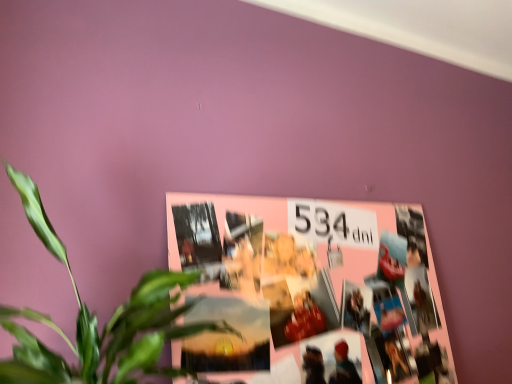
In order to face green leafy plant at center, should I rotate leftwards or rightwards?

You should rotate left by 16.769 degrees.

Identify the location of green leafy plant at center. The image size is (512, 384). (96, 321).

What do you see at coordinates (96, 321) in the screenshot? This screenshot has height=384, width=512. I see `green leafy plant at center` at bounding box center [96, 321].

Locate an element on the screen. pink paper collage at upper center is located at coordinates (308, 288).

What do you see at coordinates (308, 288) in the screenshot?
I see `pink paper collage at upper center` at bounding box center [308, 288].

This screenshot has height=384, width=512. In order to click on green leafy plant at center in this screenshot , I will do `click(96, 321)`.

Visually, is green leafy plant at center positioned to the left or to the right of pink paper collage at upper center?

Clearly, green leafy plant at center is on the left of pink paper collage at upper center in the image.

Is green leafy plant at center positioned behind pink paper collage at upper center?

No, it is in front of pink paper collage at upper center.

Which is behind, point (127, 316) or point (210, 315)?

The point (210, 315) is farther from the camera.

From the image's perspective, which is below, green leafy plant at center or pink paper collage at upper center?

pink paper collage at upper center.

From a real-world perspective, does green leafy plant at center stand above pink paper collage at upper center?

Correct, in the physical world, green leafy plant at center is higher than pink paper collage at upper center.

Which object is wider, green leafy plant at center or pink paper collage at upper center?

green leafy plant at center is wider.

Considering the sizes of green leafy plant at center and pink paper collage at upper center in the image, is green leafy plant at center taller or shorter than pink paper collage at upper center?

green leafy plant at center is shorter than pink paper collage at upper center.

Based on the photo, in terms of size, does green leafy plant at center appear bigger or smaller than pink paper collage at upper center?

Clearly, green leafy plant at center is larger in size than pink paper collage at upper center.

Choose the correct answer: Is green leafy plant at center inside pink paper collage at upper center or outside it?

green leafy plant at center is spatially situated outside pink paper collage at upper center.

Is the surface of green leafy plant at center in direct contact with pink paper collage at upper center?

No, green leafy plant at center is not beside pink paper collage at upper center.

Is green leafy plant at center facing towards pink paper collage at upper center?

No.

Where is `houseplant that is above the pink paper collage at upper center (from the image's perspective)`? The width and height of the screenshot is (512, 384). houseplant that is above the pink paper collage at upper center (from the image's perspective) is located at coordinates (96, 321).

Would you say pink paper collage at upper center is to the left or to the right of green leafy plant at center in the picture?

Clearly, pink paper collage at upper center is on the right of green leafy plant at center in the image.

From the picture: Which is in front, pink paper collage at upper center or green leafy plant at center?

Positioned in front is green leafy plant at center.

Is point (280, 321) closer to camera compared to point (116, 364)?

No, (280, 321) is further to viewer.

From the image's perspective, would you say pink paper collage at upper center is shown under green leafy plant at center?

Correct, pink paper collage at upper center appears lower than green leafy plant at center in the image.

From a real-world perspective, between pink paper collage at upper center and green leafy plant at center, who is vertically higher?

In real-world perspective, green leafy plant at center is above.

Is pink paper collage at upper center wider or thinner than green leafy plant at center?

In the image, pink paper collage at upper center appears to be more narrow than green leafy plant at center.

Can you confirm if pink paper collage at upper center is shorter than green leafy plant at center?

In fact, pink paper collage at upper center may be taller than green leafy plant at center.

Who is bigger, pink paper collage at upper center or green leafy plant at center?

Bigger between the two is green leafy plant at center.

In the scene shown: Is pink paper collage at upper center spatially inside green leafy plant at center, or outside of it?

pink paper collage at upper center is located beyond the bounds of green leafy plant at center.

Is pink paper collage at upper center next to green leafy plant at center and touching it?

pink paper collage at upper center and green leafy plant at center are not in contact.

Is pink paper collage at upper center aimed at green leafy plant at center?

No, pink paper collage at upper center is not facing towards green leafy plant at center.

How many degrees apart are the facing directions of pink paper collage at upper center and green leafy plant at center?

pink paper collage at upper center and green leafy plant at center are facing 0.755 degrees away from each other.

This screenshot has width=512, height=384. What are the coordinates of `houseplant above the pink paper collage at upper center (from the image's perspective)` in the screenshot? It's located at click(96, 321).

The height and width of the screenshot is (384, 512). I want to click on houseplant above the pink paper collage at upper center (from the image's perspective), so click(x=96, y=321).

Locate an element on the screen. This screenshot has height=384, width=512. bulletin board directly beneath the green leafy plant at center (from a real-world perspective) is located at coordinates (308, 288).